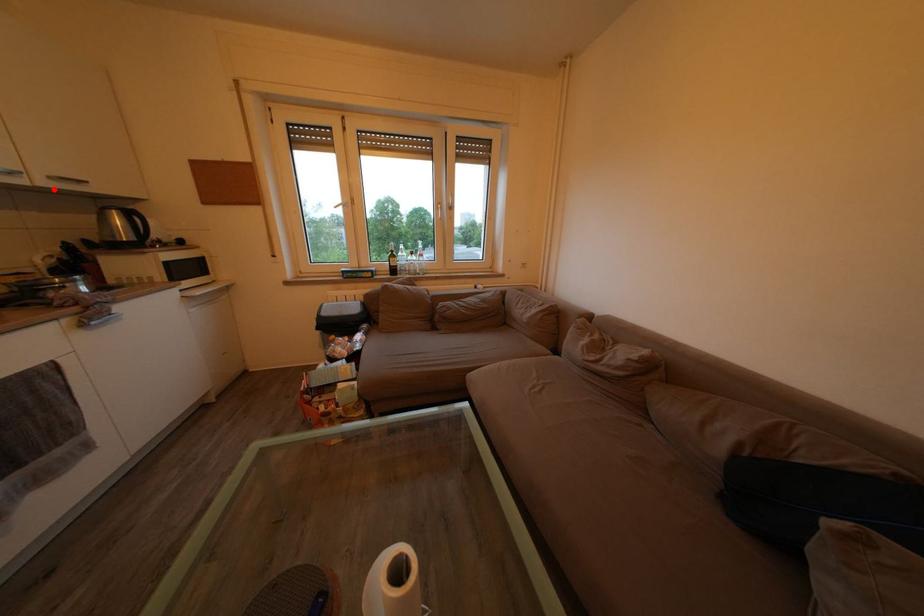
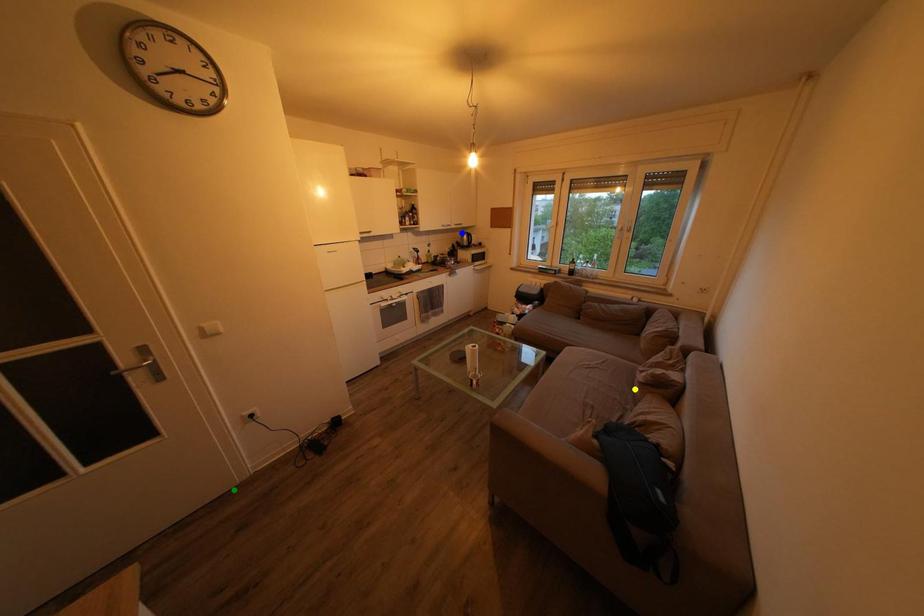
Question: I am providing you with two images of the same scene from different viewpoints. A red point is marked on the first image. You are given multiple points on the second image. Which mark in image 2 goes with the point in image 1?

Choices:
 (A) yellow point
 (B) blue point
 (C) green point

Answer: (B)